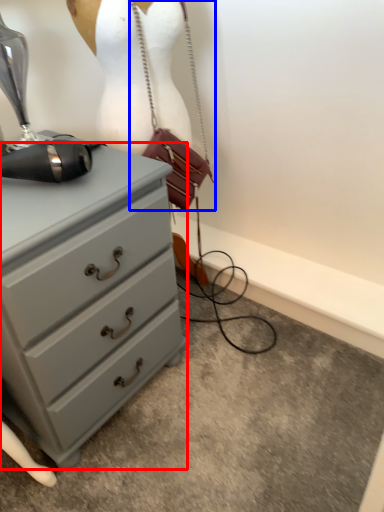
Question: Which point is closer to the camera, chest of drawers (highlighted by a red box) or handbag (highlighted by a blue box)?

Choices:
 (A) chest of drawers
 (B) handbag

Answer: (A)